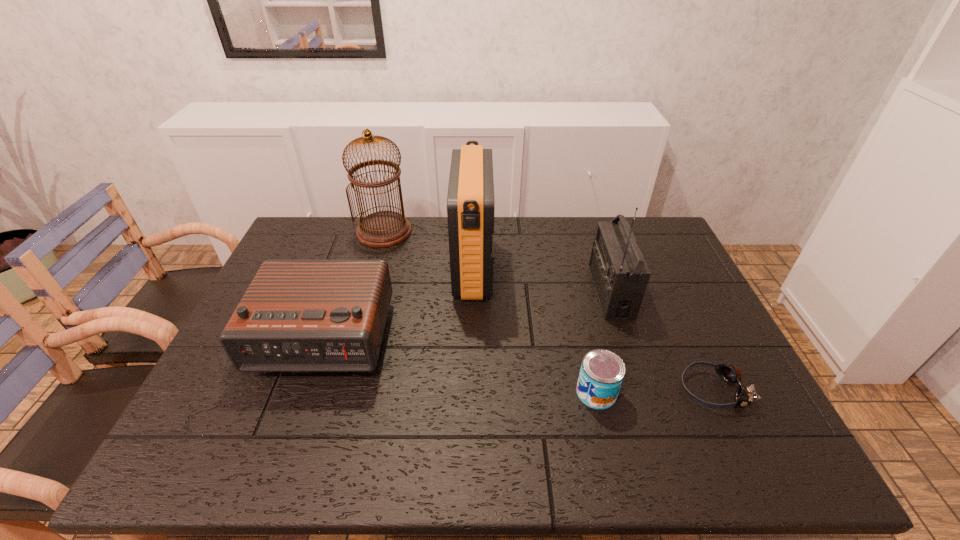
This screenshot has height=540, width=960. Find the location of `vacant area located 0.210m on the front panel of the fifth object from left to right`. vacant area located 0.210m on the front panel of the fifth object from left to right is located at coordinates (524, 291).

The width and height of the screenshot is (960, 540). Find the location of `vacant area situated on the front panel of the fifth object from left to right`. vacant area situated on the front panel of the fifth object from left to right is located at coordinates (478, 291).

This screenshot has height=540, width=960. I want to click on vacant area situated on the front panel of the fifth object from left to right, so click(x=488, y=291).

Find the location of `vacant region located on the front-facing side of the third object from left to right`. vacant region located on the front-facing side of the third object from left to right is located at coordinates (528, 269).

Locate an element on the screen. The height and width of the screenshot is (540, 960). free space located on the front panel of the third shortest object is located at coordinates (280, 447).

Find the location of a particular element. blank space located on the back of the fourth object from left to right is located at coordinates (570, 280).

The image size is (960, 540). Identify the location of vacant space located 0.370m through the lenses of the goggles. (528, 389).

You are a GUI agent. You are given a task and a screenshot of the screen. Output one action in this format:
    pyautogui.click(x=<x>, y=<y>)
    Task: Click on the vacant region located through the lenses of the goggles
    The height and width of the screenshot is (540, 960).
    Given the screenshot: What is the action you would take?
    pyautogui.click(x=603, y=389)

Where is `free space located through the lenses of the goggles`? free space located through the lenses of the goggles is located at coordinates (624, 389).

This screenshot has height=540, width=960. Identify the location of birdcage that is at the far edge. (382, 229).